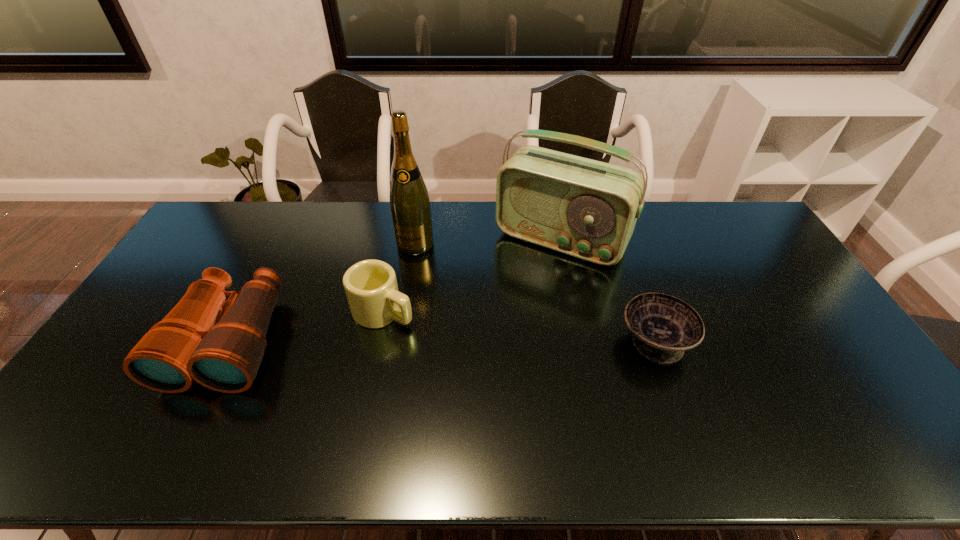
At what (x,y) coordinates should I click in order to perform the action: click on the leftmost object. Please return your answer as a coordinate pair (x, y). This screenshot has width=960, height=540. Looking at the image, I should click on (224, 354).

At what (x,y) coordinates should I click in order to perform the action: click on the shortest object. Please return your answer as a coordinate pair (x, y). Looking at the image, I should click on (663, 326).

Locate an element on the screen. This screenshot has height=540, width=960. wine bottle is located at coordinates (410, 206).

What are the coordinates of `the second tallest object` in the screenshot? It's located at (588, 209).

What are the coordinates of `mug` in the screenshot? It's located at (371, 288).

At what (x,y) coordinates should I click in order to perform the action: click on vacant space situated 0.220m on the right of the bowl. Please return your answer as a coordinate pair (x, y). The image size is (960, 540). Looking at the image, I should click on (769, 341).

What are the coordinates of `vacant space located on the front-facing side of the tallest object` in the screenshot? It's located at (384, 336).

Find the location of a particular element. The width and height of the screenshot is (960, 540). vacant space located 0.250m on the front-facing side of the tallest object is located at coordinates (394, 310).

This screenshot has height=540, width=960. In order to click on free space located on the front-facing side of the tallest object in this screenshot , I will do `click(402, 283)`.

In order to click on vacant space located on the front panel of the radio receiver in this screenshot , I will do `click(525, 284)`.